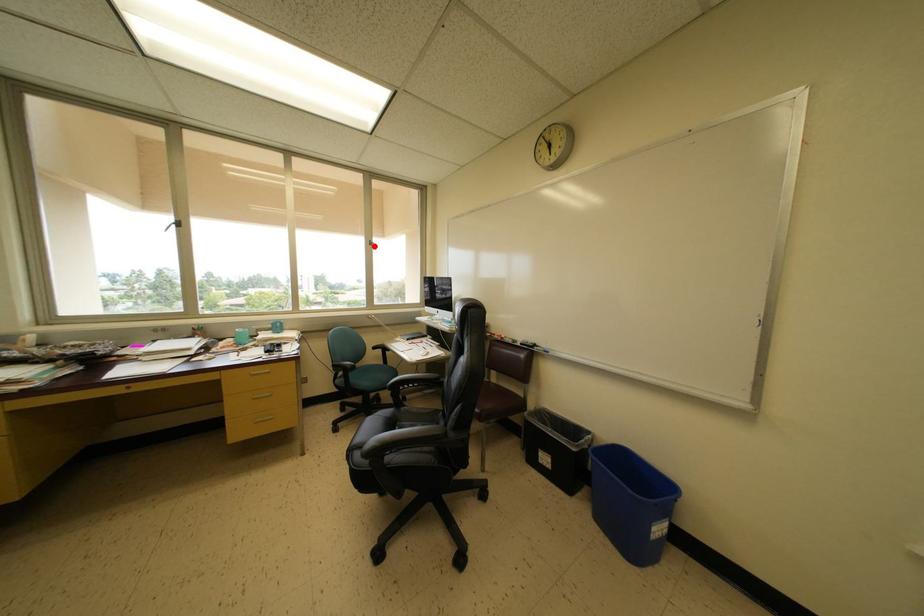
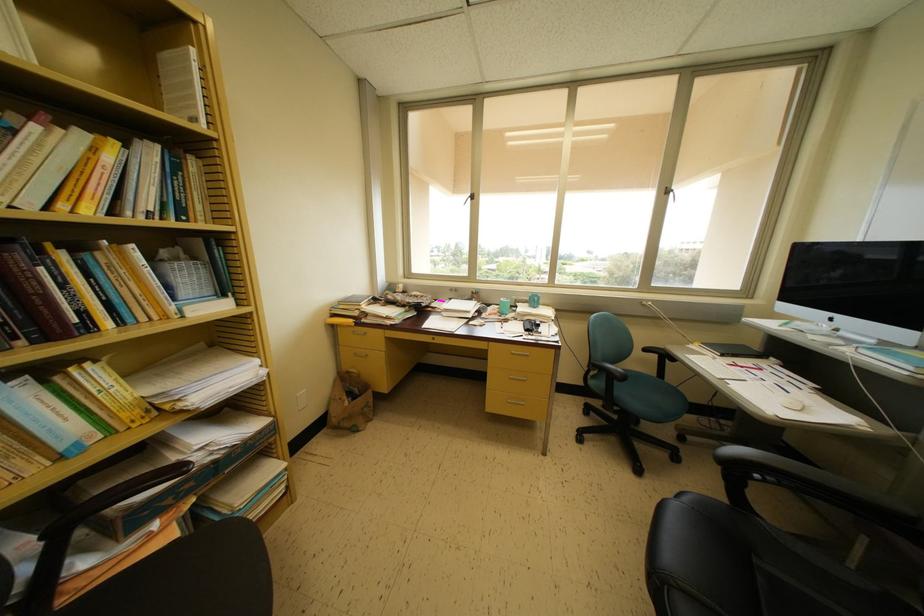
In the second image, find the point that corresponds to the highlighted location in the first image.

(671, 193)